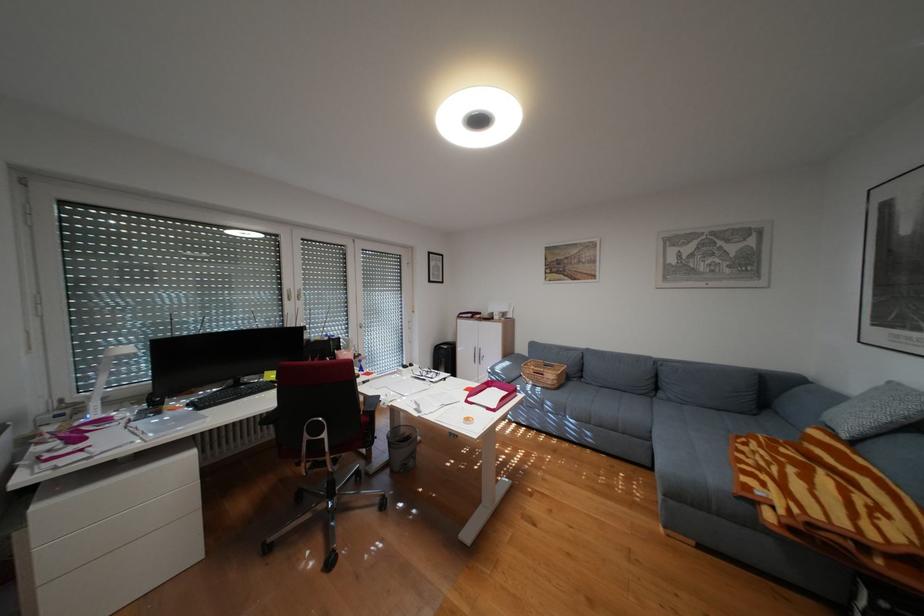
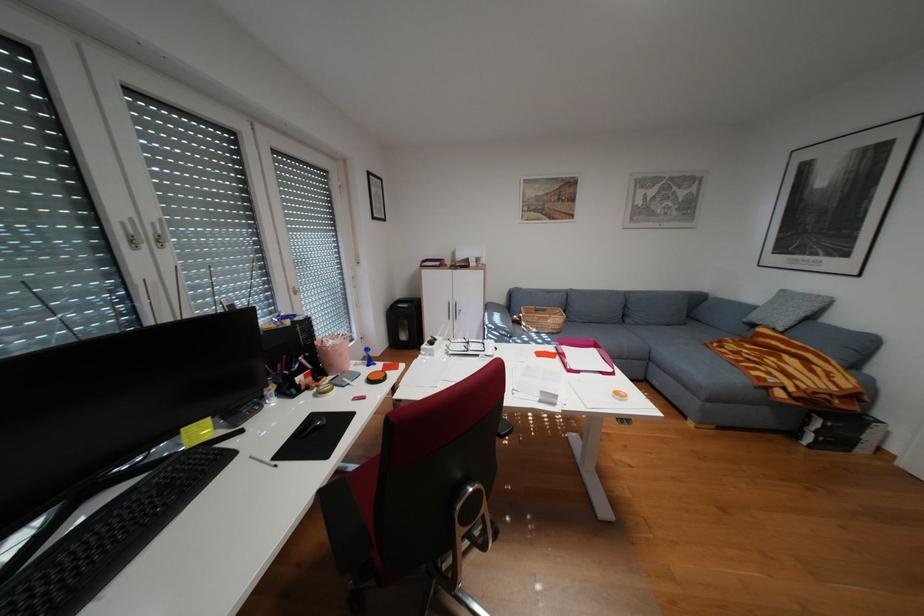
Question: I am providing you with two images of the same scene from different viewpoints. Please identify which objects are invisible in image2.

Choices:
 (A) blue desk object
 (B) white window handle
 (C) pair of eyeglasses
 (D) none of these

Answer: (D)